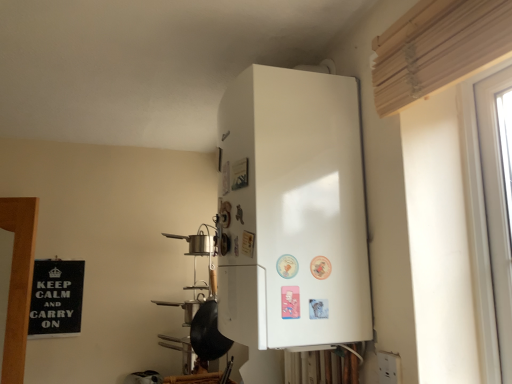
Describe the element at coordinates (293, 211) in the screenshot. Image resolution: width=512 pixels, height=384 pixels. I see `white glossy refrigerator at upper center` at that location.

Image resolution: width=512 pixels, height=384 pixels. I want to click on white glossy refrigerator at upper center, so click(x=293, y=211).

Where is `white glossy refrigerator at upper center`? white glossy refrigerator at upper center is located at coordinates (293, 211).